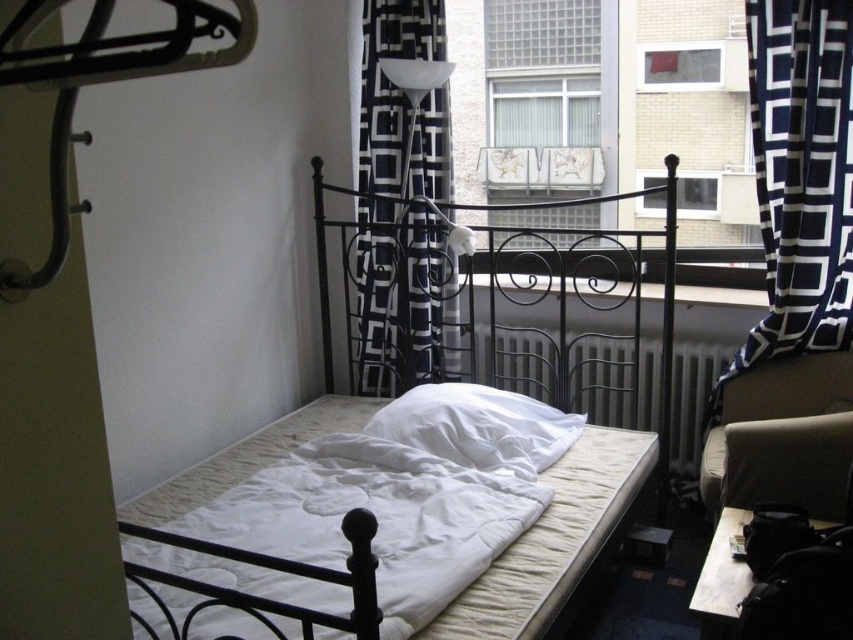
Based on the photo, can you confirm if suede-like beige armchair at lower right is thinner than glass window at upper center?

Incorrect, suede-like beige armchair at lower right's width is not less than glass window at upper center's.

In the scene shown: Between suede-like beige armchair at lower right and glass window at upper center, which one has more height?

Standing taller between the two is suede-like beige armchair at lower right.

Is point (825, 497) in front of point (666, 64)?

Yes, it is.

The image size is (853, 640). In order to click on suede-like beige armchair at lower right in this screenshot , I will do `click(782, 436)`.

Can you confirm if black/white geometric fabric curtain at upper right is thinner than black/white geometric fabric at center?

In fact, black/white geometric fabric curtain at upper right might be wider than black/white geometric fabric at center.

Between black/white geometric fabric curtain at upper right and black/white geometric fabric at center, which one appears on the right side from the viewer's perspective?

black/white geometric fabric curtain at upper right is more to the right.

Who is more forward, (814, 209) or (367, 96)?

Point (814, 209)

Identify the location of black/white geometric fabric curtain at upper right. (799, 179).

Identify the location of black/white geometric fabric curtain at upper right. (799, 179).

Find the location of a particular element. Image resolution: width=853 pixels, height=640 pixels. black/white geometric fabric curtain at upper right is located at coordinates (799, 179).